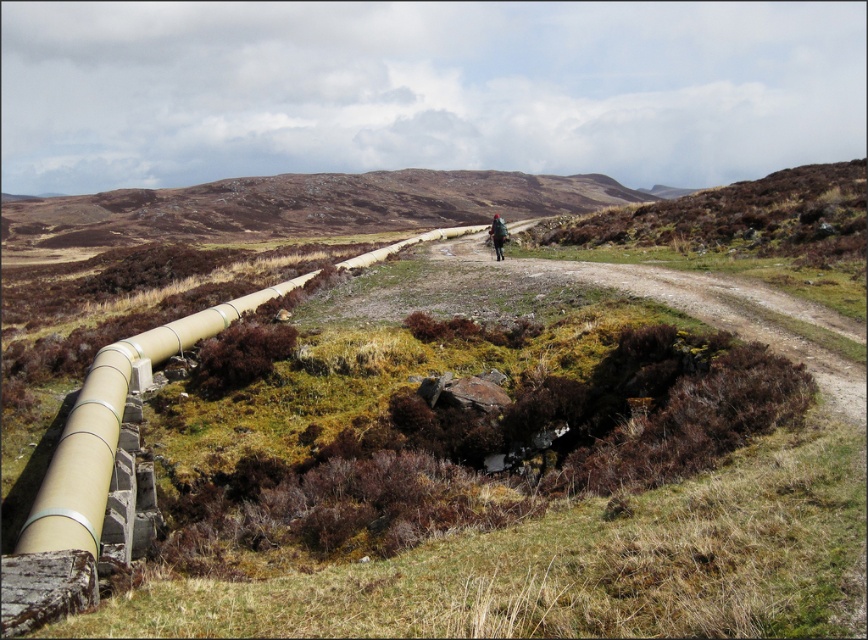
Question: Does brown grassy hillside at center appear under dark brown leather backpack at center?

Choices:
 (A) yes
 (B) no

Answer: (B)

Question: Among these objects, which one is farthest from the camera?

Choices:
 (A) brown grassy hillside at center
 (B) dark brown leather backpack at center

Answer: (A)

Question: Which point is closer to the camera taking this photo?

Choices:
 (A) (110, 236)
 (B) (495, 241)

Answer: (B)

Question: Does brown grassy hillside at center have a smaller size compared to dark brown leather backpack at center?

Choices:
 (A) yes
 (B) no

Answer: (B)

Question: In this image, where is brown grassy hillside at center located relative to dark brown leather backpack at center?

Choices:
 (A) above
 (B) below

Answer: (A)